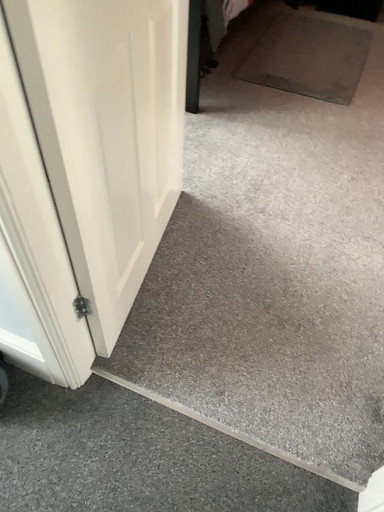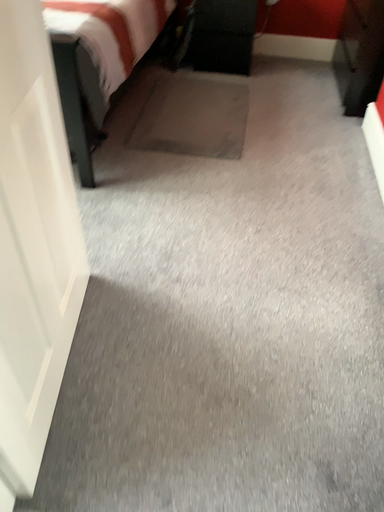
Question: How did the camera likely rotate when shooting the video?

Choices:
 (A) rotated left
 (B) rotated right

Answer: (B)